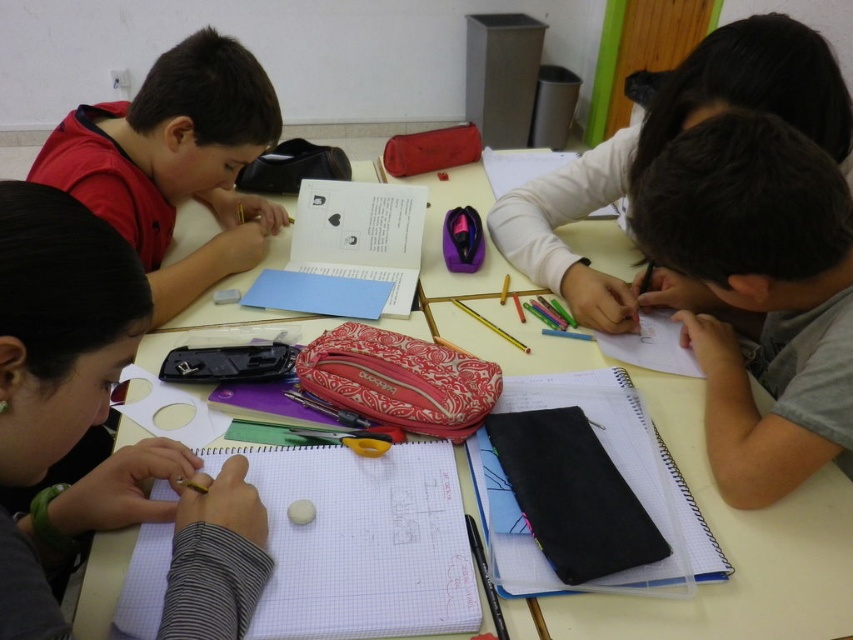
Does white paper at lower left have a greater width compared to gray matte notebook at lower right?

Yes, white paper at lower left is wider than gray matte notebook at lower right.

What do you see at coordinates (735, 552) in the screenshot? Image resolution: width=853 pixels, height=640 pixels. I see `white paper at lower left` at bounding box center [735, 552].

I want to click on white paper at lower left, so click(735, 552).

Between matte black pencil at left and black leather notebook at center, which one appears on the left side from the viewer's perspective?

matte black pencil at left

Who is more distant from viewer, [22,442] or [550,458]?

Positioned behind is point [550,458].

Does point (61, 532) lie in front of point (566, 561)?

No, (61, 532) is behind (566, 561).

Identify the location of matte black pencil at left. (59, 323).

Looking at this image, does white paper notebook at center have a smaller size compared to matte gray pencil at upper right?

Yes, white paper notebook at center is smaller than matte gray pencil at upper right.

Is white paper notebook at center thinner than matte gray pencil at upper right?

Yes.

Is point (451, 586) positioned behind point (643, 132)?

No, it is in front of (643, 132).

Locate an element on the screen. This screenshot has height=640, width=853. white paper notebook at center is located at coordinates (363, 541).